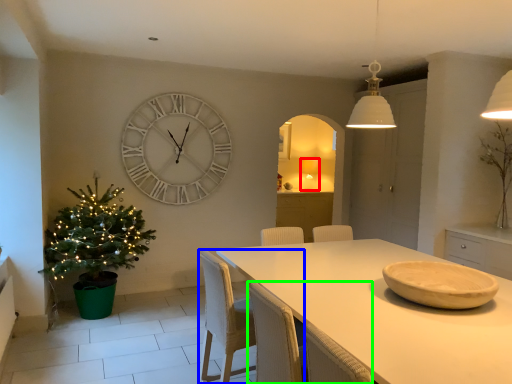
Question: Which object is the farthest from lamp (highlighted by a red box)? Choose among these: chair (highlighted by a blue box) or armchair (highlighted by a green box).

Choices:
 (A) chair
 (B) armchair

Answer: (B)